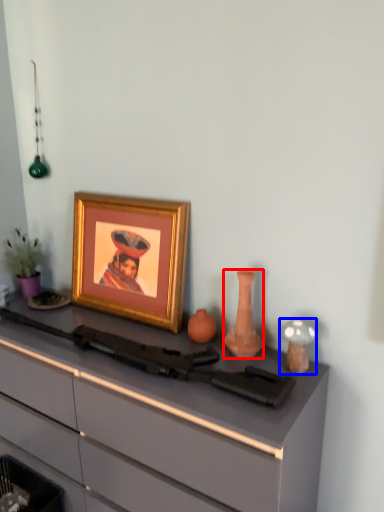
Question: Which object appears farthest to the camera in this image, vase (highlighted by a red box) or candle holder (highlighted by a blue box)?

Choices:
 (A) vase
 (B) candle holder

Answer: (A)